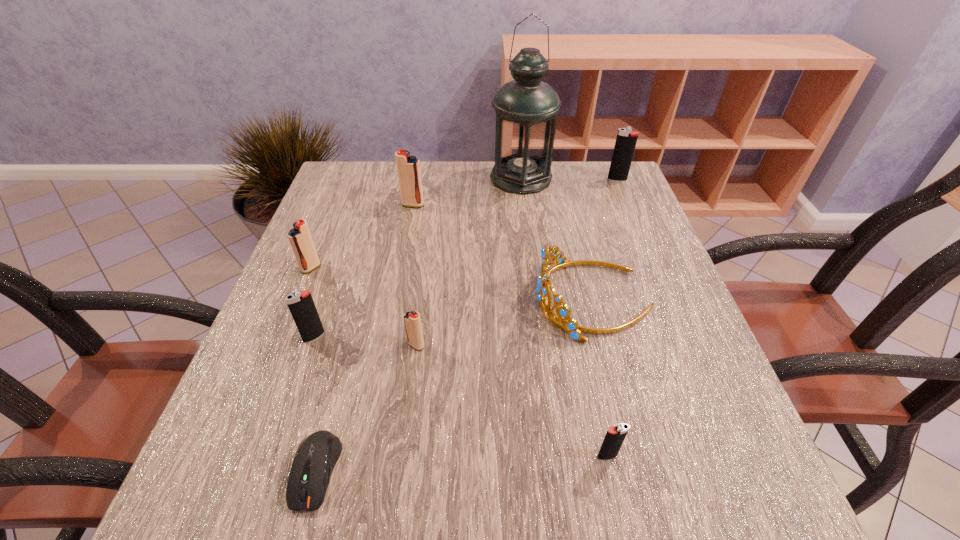
Find the location of a particular element. The height and width of the screenshot is (540, 960). the leftmost red igniter is located at coordinates (300, 238).

Locate an element on the screen. This screenshot has height=540, width=960. the third igniter from right to left is located at coordinates (412, 320).

I want to click on the nearest red igniter, so click(412, 320).

You are a GUI agent. You are given a task and a screenshot of the screen. Output one action in this format:
    pyautogui.click(x=<x>, y=<y>)
    Task: Click on the second igniter from right to left
    This screenshot has width=960, height=540.
    Given the screenshot: What is the action you would take?
    pyautogui.click(x=614, y=438)

The image size is (960, 540). I want to click on the smallest black igniter, so click(x=614, y=438).

The image size is (960, 540). What are the coordinates of `the shortest object` in the screenshot? It's located at (314, 461).

At what (x,y) coordinates should I click in order to perform the action: click on computer equipment. Please return your answer as a coordinate pair (x, y). Looking at the image, I should click on (314, 461).

Identify the location of free region located on the right of the tallest object. This screenshot has height=540, width=960. (603, 178).

Find the location of a particular element. vacant area situated 0.210m on the right of the biggest red igniter is located at coordinates (507, 205).

In order to click on free spot located on the back of the biggest black igniter in this screenshot , I will do `click(612, 166)`.